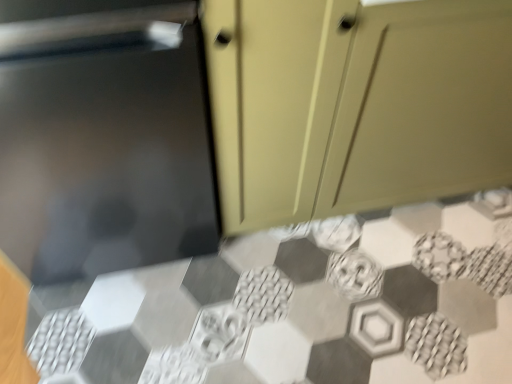
This screenshot has height=384, width=512. What do you see at coordinates (354, 104) in the screenshot?
I see `matte beige cabinet at upper right` at bounding box center [354, 104].

I want to click on matte beige cabinet at upper right, so click(354, 104).

Measure the distance between point (217, 171) and camera.

1.09 meters.

From the picture: Measure the distance between point [482,337] and camera.

Point [482,337] is 4.25 feet away from camera.

What do you see at coordinates (300, 306) in the screenshot? This screenshot has height=384, width=512. I see `hexagonal mosaic tile at center` at bounding box center [300, 306].

This screenshot has width=512, height=384. What are the coordinates of `hexagonal mosaic tile at center` in the screenshot? It's located at (300, 306).

Measure the distance between hexagonal mosaic tile at center and camera.

A distance of 1.20 meters exists between hexagonal mosaic tile at center and camera.

Where is `matte beige cabinet at upper right`? matte beige cabinet at upper right is located at coordinates (354, 104).

Based on the photo, which is more to the left, matte beige cabinet at upper right or hexagonal mosaic tile at center?

Positioned to the left is hexagonal mosaic tile at center.

Is matte beige cabinet at upper right positioned behind hexagonal mosaic tile at center?

No, it is in front of hexagonal mosaic tile at center.

Is point (241, 33) in front of point (194, 264)?

Yes, point (241, 33) is in front of point (194, 264).

From the image's perspective, relative to hexagonal mosaic tile at center, is matte beige cabinet at upper right above or below?

Clearly, from the image's perspective, matte beige cabinet at upper right is above hexagonal mosaic tile at center.

From a real-world perspective, is matte beige cabinet at upper right physically below hexagonal mosaic tile at center?

No.

Considering the relative sizes of matte beige cabinet at upper right and hexagonal mosaic tile at center in the image provided, is matte beige cabinet at upper right thinner than hexagonal mosaic tile at center?

Correct, the width of matte beige cabinet at upper right is less than that of hexagonal mosaic tile at center.

Is matte beige cabinet at upper right taller or shorter than hexagonal mosaic tile at center?

Clearly, matte beige cabinet at upper right is taller compared to hexagonal mosaic tile at center.

Which of these two, matte beige cabinet at upper right or hexagonal mosaic tile at center, is smaller?

Smaller between the two is hexagonal mosaic tile at center.

Is matte beige cabinet at upper right located outside hexagonal mosaic tile at center?

That's correct, matte beige cabinet at upper right is outside of hexagonal mosaic tile at center.

Is the surface of matte beige cabinet at upper right in direct contact with hexagonal mosaic tile at center?

No.

Based on the photo, is matte beige cabinet at upper right oriented away from hexagonal mosaic tile at center?

That's not correct — matte beige cabinet at upper right is not looking away from hexagonal mosaic tile at center.

Consider the image. Can you tell me how much matte beige cabinet at upper right and hexagonal mosaic tile at center differ in facing direction?

The angle between the facing direction of matte beige cabinet at upper right and the facing direction of hexagonal mosaic tile at center is 0.787 degrees.

Measure the distance from matte beige cabinet at upper right to hexagonal mosaic tile at center.

The distance of matte beige cabinet at upper right from hexagonal mosaic tile at center is 18.83 inches.

Find the location of `cabinetry that is in front of the hexagonal mosaic tile at center`. cabinetry that is in front of the hexagonal mosaic tile at center is located at coordinates (354, 104).

Considering the positions of objects hexagonal mosaic tile at center and matte beige cabinet at upper right in the image provided, who is more to the right, hexagonal mosaic tile at center or matte beige cabinet at upper right?

matte beige cabinet at upper right.

Which object is more forward, hexagonal mosaic tile at center or matte beige cabinet at upper right?

matte beige cabinet at upper right is closer to the camera.

Which point is more distant from viewer, (56,368) or (228,35)?

The point (56,368) is behind.

From the image's perspective, is hexagonal mosaic tile at center on matte beige cabinet at upper right?

Incorrect, from the image's perspective, hexagonal mosaic tile at center is lower than matte beige cabinet at upper right.

From a real-world perspective, relative to matte beige cabinet at upper right, is hexagonal mosaic tile at center vertically above or below?

Clearly, from a real-world perspective, hexagonal mosaic tile at center is below matte beige cabinet at upper right.

Can you confirm if hexagonal mosaic tile at center is thinner than matte beige cabinet at upper right?

No.

Which of these two, hexagonal mosaic tile at center or matte beige cabinet at upper right, stands taller?

Standing taller between the two is matte beige cabinet at upper right.

Which of these two, hexagonal mosaic tile at center or matte beige cabinet at upper right, is smaller?

With smaller size is hexagonal mosaic tile at center.

Would you say hexagonal mosaic tile at center is outside matte beige cabinet at upper right?

Yes, hexagonal mosaic tile at center is located beyond the bounds of matte beige cabinet at upper right.

Is hexagonal mosaic tile at center next to matte beige cabinet at upper right and touching it?

hexagonal mosaic tile at center and matte beige cabinet at upper right are not in contact.

Is hexagonal mosaic tile at center facing towards matte beige cabinet at upper right?

No, hexagonal mosaic tile at center is not facing towards matte beige cabinet at upper right.

What's the angular difference between hexagonal mosaic tile at center and matte beige cabinet at upper right's facing directions?

The angular difference between hexagonal mosaic tile at center and matte beige cabinet at upper right is 0.787 degrees.

How much distance is there between hexagonal mosaic tile at center and matte beige cabinet at upper right?

18.83 inches.

The width and height of the screenshot is (512, 384). Find the location of `cabinetry on the right side of hexagonal mosaic tile at center`. cabinetry on the right side of hexagonal mosaic tile at center is located at coordinates (354, 104).

Where is `ceramic tile below the matte beige cabinet at upper right (from the image's perspective)`? The image size is (512, 384). ceramic tile below the matte beige cabinet at upper right (from the image's perspective) is located at coordinates (300, 306).

Where is `ceramic tile located behind the matte beige cabinet at upper right`? ceramic tile located behind the matte beige cabinet at upper right is located at coordinates (300, 306).